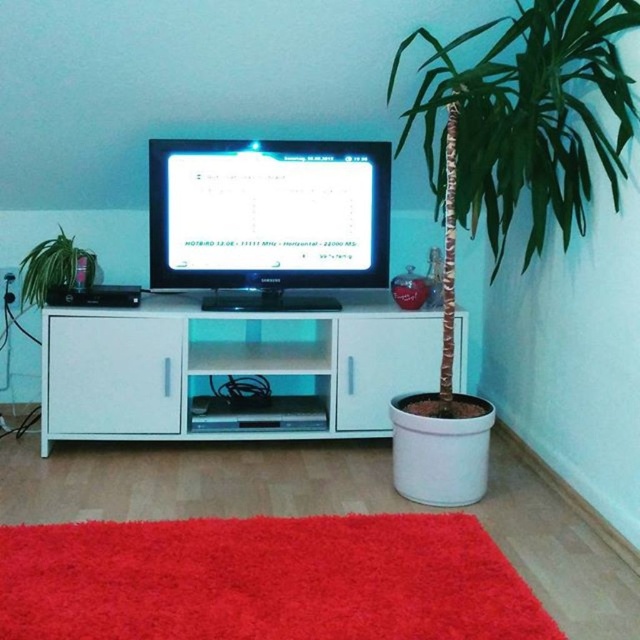
Looking at this image, between white glossy cabinet at center and green matte plant at left, which one is positioned higher?

green matte plant at left is higher up.

The height and width of the screenshot is (640, 640). What do you see at coordinates (230, 369) in the screenshot? I see `white glossy cabinet at center` at bounding box center [230, 369].

Who is more forward, (61,308) or (83,256)?

Point (61,308) is more forward.

The height and width of the screenshot is (640, 640). In order to click on white glossy cabinet at center in this screenshot , I will do `click(230, 369)`.

Which of these two, white glossy cabinet at center or matte black monitor at center, stands shorter?

Standing shorter between the two is white glossy cabinet at center.

Can you confirm if white glossy cabinet at center is positioned above matte black monitor at center?

Incorrect, white glossy cabinet at center is not positioned above matte black monitor at center.

Between point (72, 321) and point (232, 240), which one is positioned in front?

Point (72, 321) is more forward.

I want to click on white glossy cabinet at center, so [230, 369].

Is matte black monitor at center further to camera compared to green matte plant at left?

Yes, it is.

Is matte black monitor at center shorter than green matte plant at left?

No.

This screenshot has height=640, width=640. I want to click on matte black monitor at center, so click(268, 220).